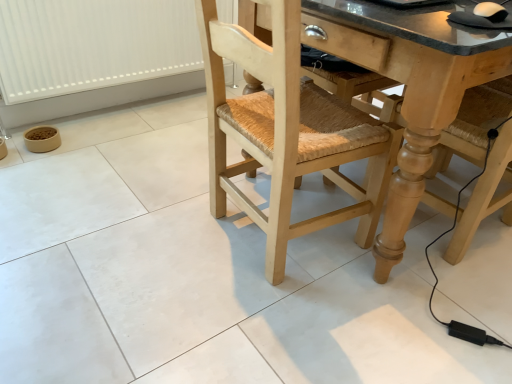
Locate an element on the screen. This screenshot has width=512, height=384. vacant space in front of natural wood chair at center is located at coordinates (282, 325).